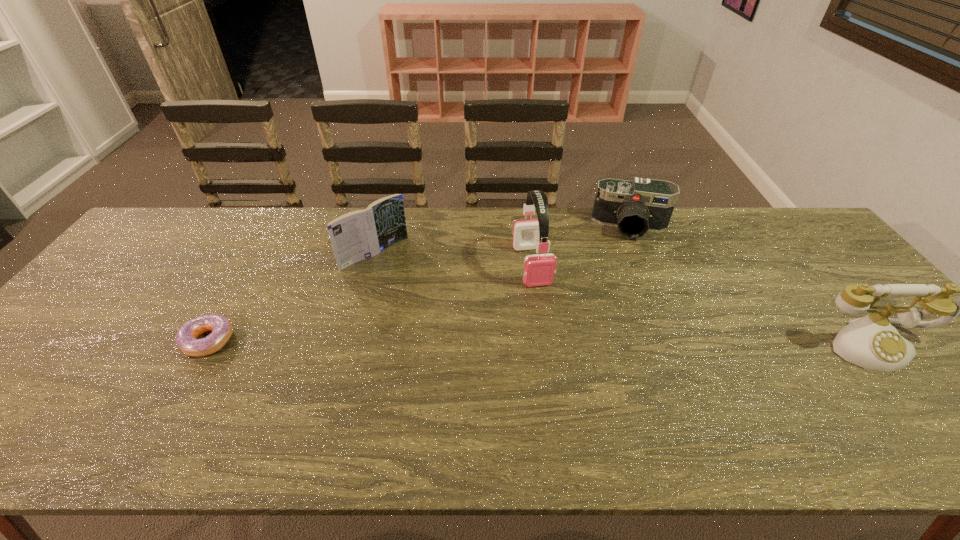
Where is `free space on the desktop that is between the shortest object and the rightmost object and is positioned on the front cover of the fourth object from right to left`? The image size is (960, 540). free space on the desktop that is between the shortest object and the rightmost object and is positioned on the front cover of the fourth object from right to left is located at coordinates (472, 342).

Where is `free spot on the desktop that is between the leftmost object and the telephone and is positioned on the outer surface of the tallest object`? free spot on the desktop that is between the leftmost object and the telephone and is positioned on the outer surface of the tallest object is located at coordinates (557, 343).

Locate an element on the screen. vacant space on the desktop that is between the leftmost object and the rightmost object and is positioned on the front-facing side of the fourth object from left to right is located at coordinates (632, 343).